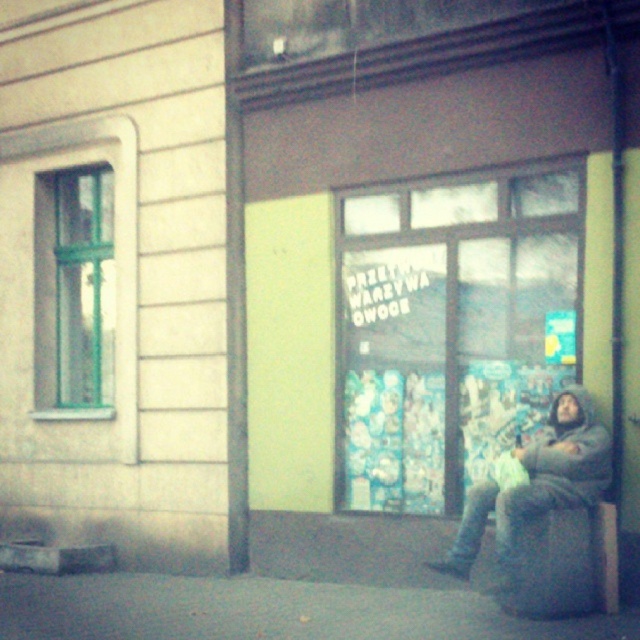
Based on the photo, you are standing in the urban street scene and want to pick up the fuzzy gray coat at lower right. What are the coordinates where you should look to find it?

The fuzzy gray coat at lower right is located at coordinates point (536, 484).

You are a delivery person holding a package that is 12 inches long. You need to place it between the fuzzy gray coat at lower right and the gray fabric stool at lower right. Can the package fit in the space between them?

The fuzzy gray coat at lower right is 11.06 inches away from the gray fabric stool at lower right. Since the package is 12 inches long, it cannot fit in the space between them as the distance is shorter than the package length.